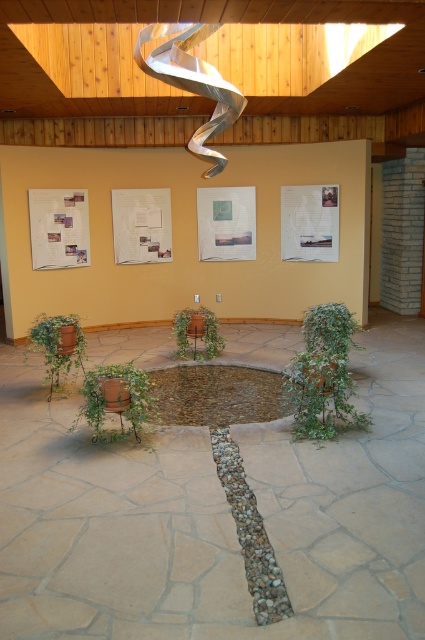
Does point (64, 352) lie behind point (184, 320)?

No, (64, 352) is closer to viewer.

Describe the element at coordinates (57, 344) in the screenshot. I see `green matte pot at lower left` at that location.

What are the coordinates of `green matte pot at lower left` in the screenshot? It's located at (57, 344).

Describe the element at coordinates (323, 374) in the screenshot. This screenshot has height=640, width=425. I see `green leafy plant at center` at that location.

Is green leafy plant at center thinner than green matte pot at lower left?

In fact, green leafy plant at center might be wider than green matte pot at lower left.

Does point (320, 356) lie behind point (70, 344)?

No, (320, 356) is closer to viewer.

In order to click on green leafy plant at center in this screenshot , I will do click(x=323, y=374).

Describe the element at coordinates (116, 401) in the screenshot. The image size is (425, 640). I see `green matte pot at center` at that location.

Does point (110, 368) come farther from viewer compared to point (215, 321)?

No, it is in front of (215, 321).

The image size is (425, 640). I want to click on green matte pot at center, so click(116, 401).

At what (x,y) coordinates should I click in order to perform the action: click on green matte pot at center. Please return your answer as a coordinate pair (x, y). The image size is (425, 640). Looking at the image, I should click on click(116, 401).